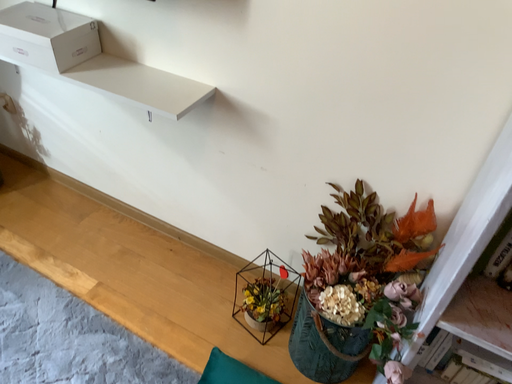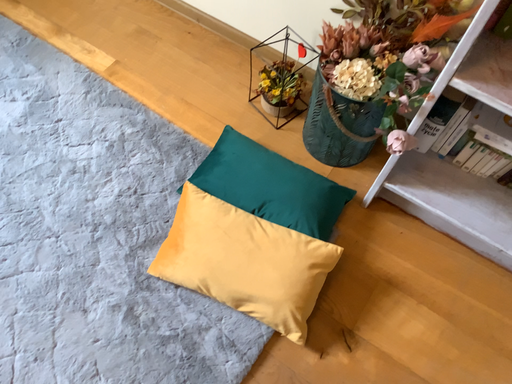
Question: Which way did the camera rotate in the video?

Choices:
 (A) rotated downward
 (B) rotated upward

Answer: (A)